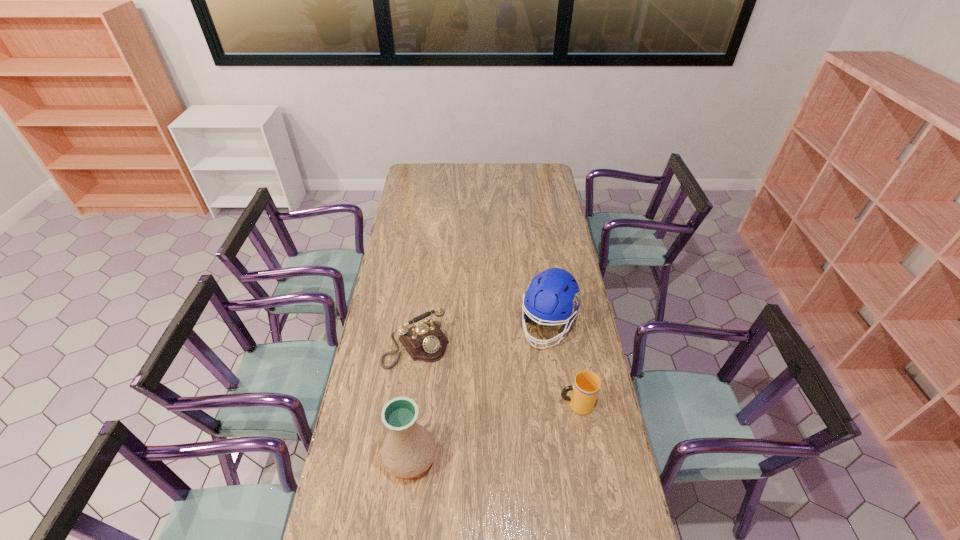
This screenshot has width=960, height=540. Find the location of `free space on the desktop that is between the nearest object and the cup and is positioned on the dial of the telephone`. free space on the desktop that is between the nearest object and the cup and is positioned on the dial of the telephone is located at coordinates pos(480,435).

The image size is (960, 540). Identify the location of free space on the desktop that is between the pottery and the third farthest object and is positioned on the front-facing side of the football helmet. (502, 428).